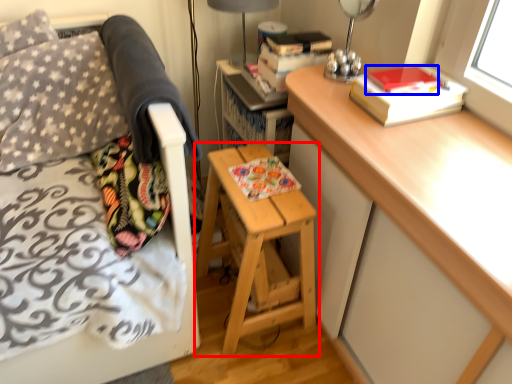
Question: Which object appears farthest to the camera in this image, stool (highlighted by a red box) or paperback book (highlighted by a blue box)?

Choices:
 (A) stool
 (B) paperback book

Answer: (A)